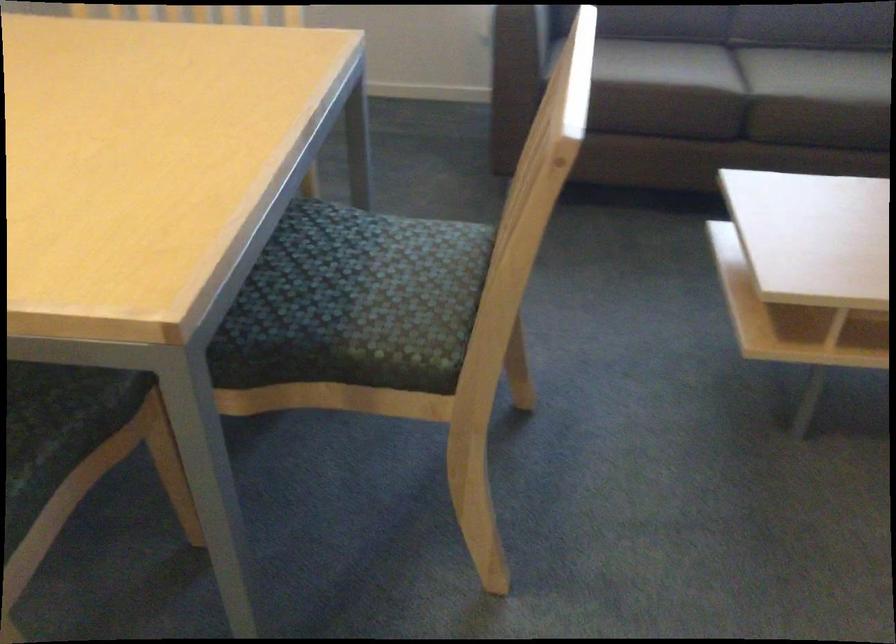
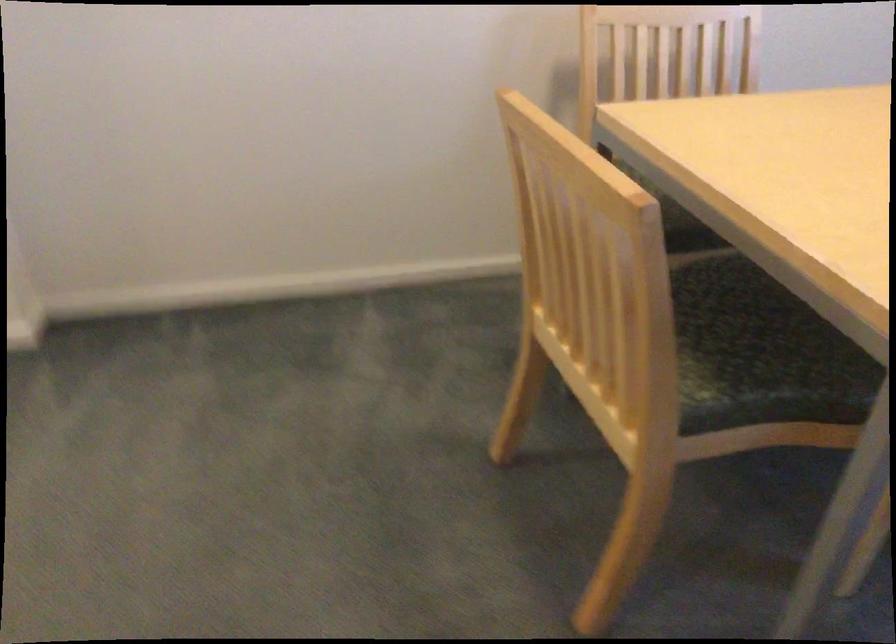
Question: The first image is from the beginning of the video and the second image is from the end. How did the camera likely rotate when shooting the video?

Choices:
 (A) Left
 (B) Right
 (C) Up
 (D) Down

Answer: (A)